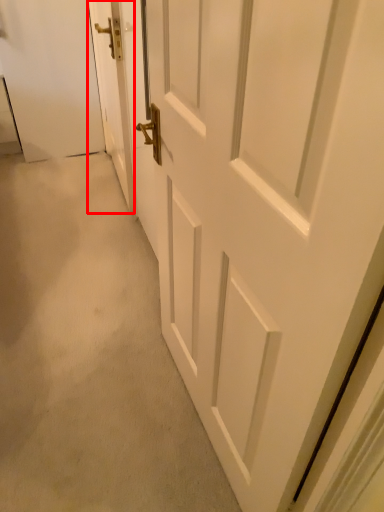
Question: From the image's perspective, what is the correct spatial relationship of door (annotated by the red box) in relation to door?

Choices:
 (A) above
 (B) below

Answer: (A)